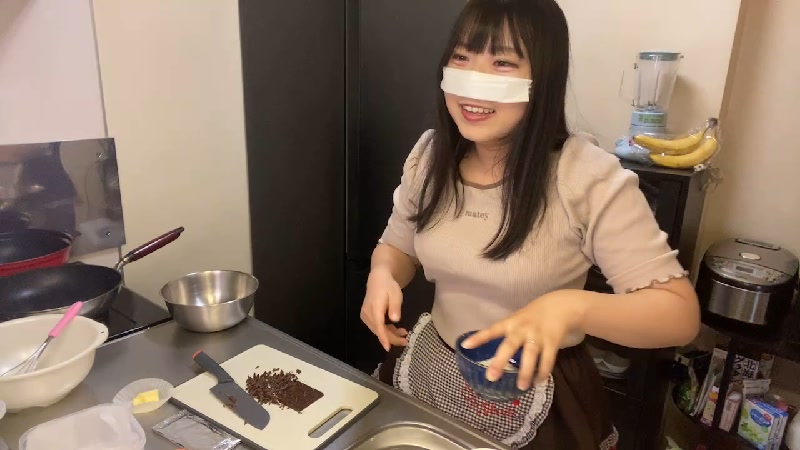
Identify the location of pink whisk handle. (66, 321).